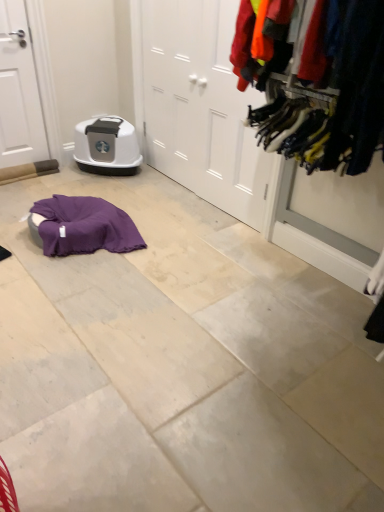
Question: From a real-world perspective, is white matte door at center, acting as the first door starting from the right, on matte gray plastic litter box at center?

Choices:
 (A) yes
 (B) no

Answer: (A)

Question: Does white matte door at center, acting as the first door starting from the right, have a greater height compared to matte gray plastic litter box at center?

Choices:
 (A) no
 (B) yes

Answer: (B)

Question: Does white matte door at center, positioned as the second door in left-to-right order, have a lesser width compared to matte gray plastic litter box at center?

Choices:
 (A) yes
 (B) no

Answer: (A)

Question: Is white matte door at center, positioned as the second door in left-to-right order, completely or partially outside of matte gray plastic litter box at center?

Choices:
 (A) no
 (B) yes

Answer: (B)

Question: Is white matte door at center, acting as the first door starting from the right, at the right side of matte gray plastic litter box at center?

Choices:
 (A) no
 (B) yes

Answer: (B)

Question: Does white matte door at center, acting as the first door starting from the right, contain matte gray plastic litter box at center?

Choices:
 (A) no
 (B) yes

Answer: (A)

Question: Is white matte door at center, acting as the first door starting from the right, completely or partially inside matte gray plastic litter box at center?

Choices:
 (A) yes
 (B) no

Answer: (B)

Question: Considering the relative positions of matte gray plastic litter box at center and white matte door at center, positioned as the second door in left-to-right order, in the image provided, is matte gray plastic litter box at center to the left of white matte door at center, positioned as the second door in left-to-right order, from the viewer's perspective?

Choices:
 (A) no
 (B) yes

Answer: (B)

Question: Are matte gray plastic litter box at center and white matte door at center, acting as the first door starting from the right, making contact?

Choices:
 (A) no
 (B) yes

Answer: (A)

Question: Is matte gray plastic litter box at center bigger than white matte door at center, positioned as the second door in left-to-right order?

Choices:
 (A) yes
 (B) no

Answer: (B)

Question: From a real-world perspective, is matte gray plastic litter box at center physically above white matte door at center, acting as the first door starting from the right?

Choices:
 (A) yes
 (B) no

Answer: (B)

Question: From a real-world perspective, is matte gray plastic litter box at center physically below white matte door at center, acting as the first door starting from the right?

Choices:
 (A) no
 (B) yes

Answer: (B)

Question: Is white matte door at left, positioned as the second door in right-to-left order, facing towards matte gray plastic litter box at center?

Choices:
 (A) no
 (B) yes

Answer: (A)